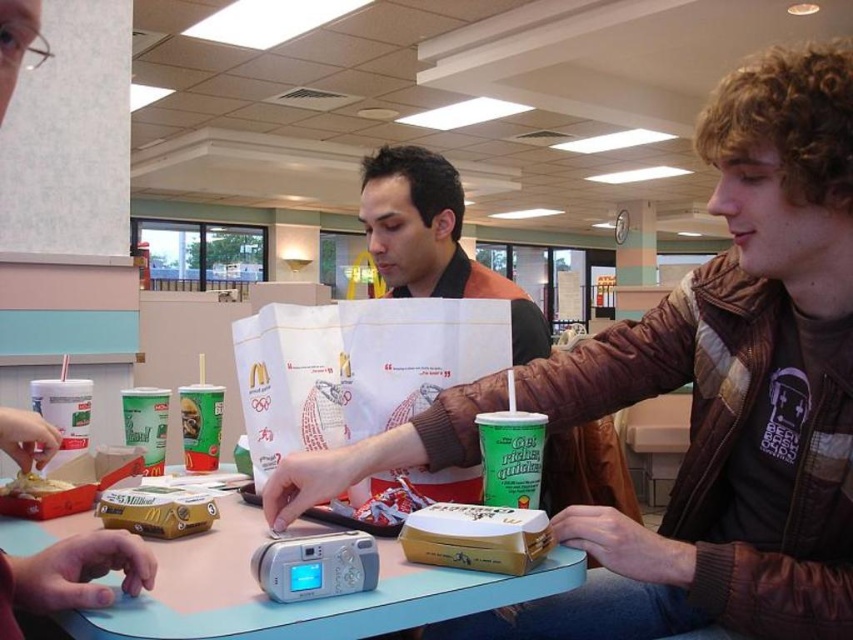
Question: Is the position of printed paper bag at center more distant than that of golden crispy chicken at center?

Choices:
 (A) no
 (B) yes

Answer: (A)

Question: Is metallic silver camera at center closer to camera compared to printed paper bag at center?

Choices:
 (A) no
 (B) yes

Answer: (B)

Question: Which of the following is the closest to the observer?

Choices:
 (A) (703, 282)
 (B) (537, 582)

Answer: (B)

Question: Which of the following is the farthest from the observer?

Choices:
 (A) (573, 387)
 (B) (0, 493)
 (C) (114, 577)

Answer: (A)

Question: Which of these objects is positioned farthest from the brown leather jacket at center?

Choices:
 (A) matte black camera at center
 (B) printed paper bag at center
 (C) metallic silver camera at center
 (D) golden crispy chicken at center

Answer: (D)

Question: Can you confirm if matte black camera at center is positioned above printed paper bag at center?

Choices:
 (A) yes
 (B) no

Answer: (A)